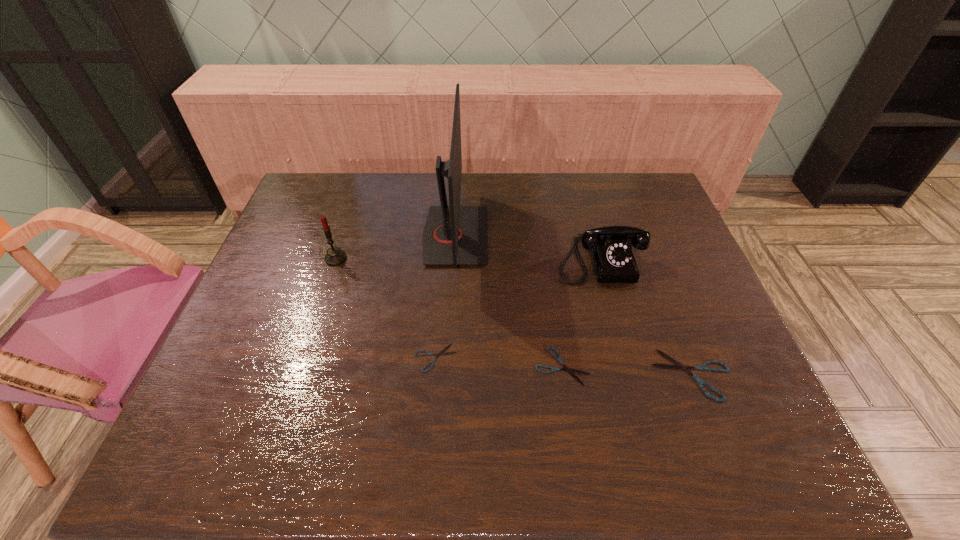
Image resolution: width=960 pixels, height=540 pixels. In order to click on free spot located on the back of the leftmost shears in this screenshot , I will do [444, 258].

In order to click on vacant space located 0.400m on the back of the second shears from left to right in this screenshot , I will do `click(542, 237)`.

The width and height of the screenshot is (960, 540). Find the location of `free spot located on the back of the fourth tallest object`. free spot located on the back of the fourth tallest object is located at coordinates (642, 243).

Image resolution: width=960 pixels, height=540 pixels. In order to click on free location located 0.400m on the screen side of the tallest object in this screenshot , I will do `click(620, 236)`.

Identify the location of free spot located on the dial of the fourth shortest object. (612, 308).

The image size is (960, 540). Identify the location of vacant area situated 0.190m on the right of the fifth shortest object. (413, 259).

Locate an element on the screen. object that is at the far edge is located at coordinates (454, 235).

The height and width of the screenshot is (540, 960). Find the location of `shears at the right edge`. shears at the right edge is located at coordinates click(678, 365).

Where is `telephone at the right edge`? The width and height of the screenshot is (960, 540). telephone at the right edge is located at coordinates (610, 247).

You are a GUI agent. You are given a task and a screenshot of the screen. Output one action in this format:
    pyautogui.click(x=<x>, y=<y>)
    Task: Click on the object positioned at the near right corner
    Image resolution: width=960 pixels, height=540 pixels.
    Given the screenshot: What is the action you would take?
    pyautogui.click(x=678, y=365)